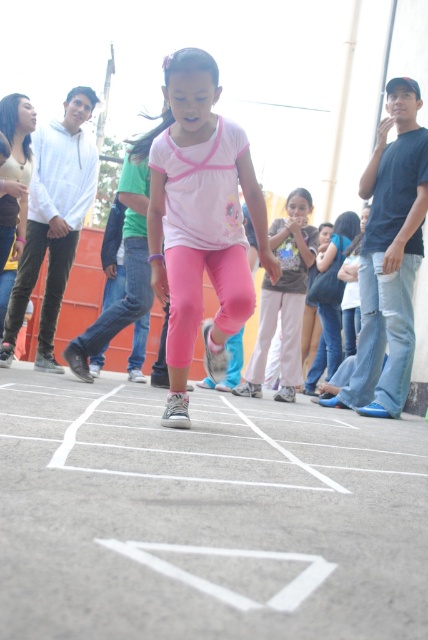
Is pink matte leggings at center smaller than pink fabric pants at center?

No, pink matte leggings at center is not smaller than pink fabric pants at center.

Which is below, pink matte leggings at center or pink fabric pants at center?

pink fabric pants at center is lower down.

Is point (184, 99) closer to camera compared to point (312, 262)?

Yes.

Where is `pink matte leggings at center`? This screenshot has width=428, height=640. pink matte leggings at center is located at coordinates (199, 221).

Does pink fabric leggings at center have a greater height compared to pink fabric leggings at upper left?

Yes.

Which is behind, point (377, 180) or point (44, 369)?

The point (44, 369) is behind.

You are a GUI agent. You are given a task and a screenshot of the screen. Output one action in this format:
    pyautogui.click(x=<x>, y=<y>)
    Task: Click on the pink fabric leggings at center
    The height and width of the screenshot is (640, 428).
    Given the screenshot: What is the action you would take?
    pyautogui.click(x=389, y=259)

Is white painted lines at center positioned in front of pink fabric leggings at center?

Yes, white painted lines at center is closer to the viewer.

Can you confirm if white painted lines at center is thinner than pink fabric leggings at center?

No, white painted lines at center is not thinner than pink fabric leggings at center.

Where is `white painted lines at center`? Image resolution: width=428 pixels, height=640 pixels. white painted lines at center is located at coordinates (205, 516).